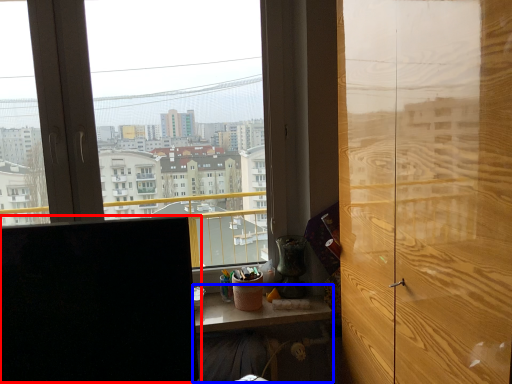
Question: Which of the following is the closest to the observer, computer monitor (highlighted by a red box) or table (highlighted by a blue box)?

Choices:
 (A) computer monitor
 (B) table

Answer: (A)